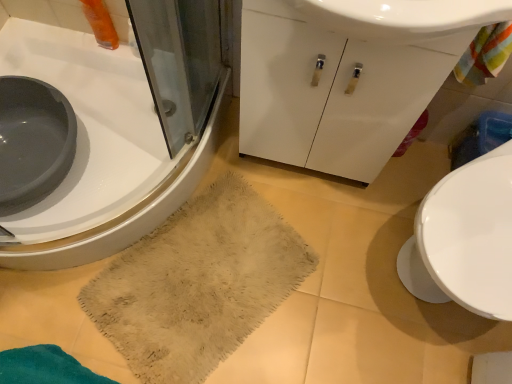
Locate an element on the screen. The height and width of the screenshot is (384, 512). free space in front of white glossy cabinet at center is located at coordinates [x=323, y=232].